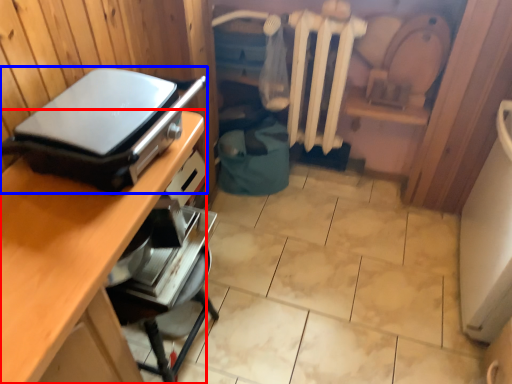
Question: Which object appears farthest to the camera in this image, desk (highlighted by a red box) or appliance (highlighted by a blue box)?

Choices:
 (A) desk
 (B) appliance

Answer: (B)